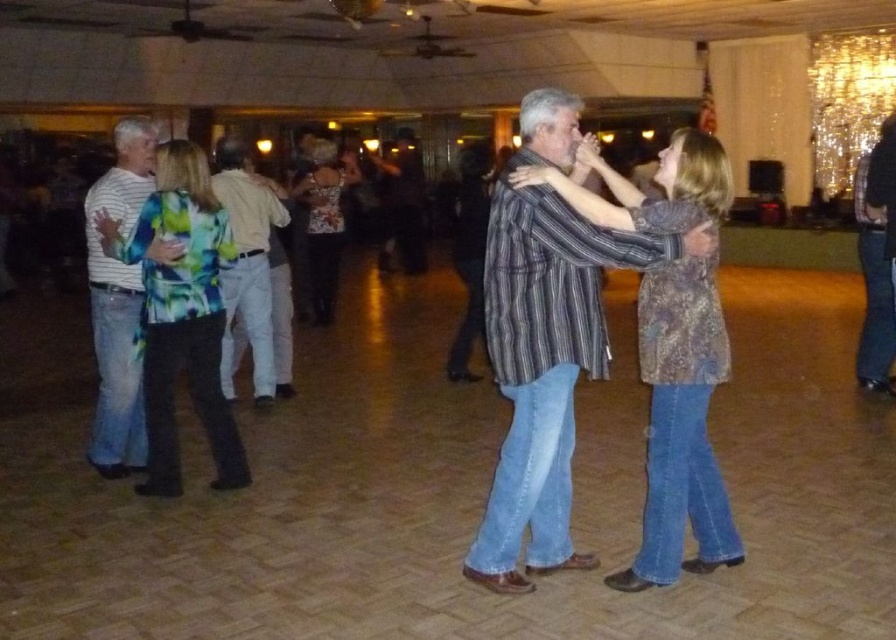
Is striped cotton shirt at left taller than light brown cotton shirt at center?

Correct, striped cotton shirt at left is much taller as light brown cotton shirt at center.

Is point (92, 278) less distant than point (270, 396)?

Yes, it is in front of point (270, 396).

Between point (126, 180) and point (237, 275), which one is positioned in front?

Point (126, 180)

Where is `striped cotton shirt at left`? striped cotton shirt at left is located at coordinates pos(118,305).

What do you see at coordinates (545, 340) in the screenshot? This screenshot has width=896, height=640. I see `striped cotton shirt at center` at bounding box center [545, 340].

Can you confirm if striped cotton shirt at center is bigger than dark brown leather jacket at center?

Actually, striped cotton shirt at center might be smaller than dark brown leather jacket at center.

In order to click on striped cotton shirt at center in this screenshot , I will do `click(545, 340)`.

I want to click on striped cotton shirt at center, so click(545, 340).

In the scene shown: Does printed silk blouse at center appear on the right side of dark brown leather jacket at center?

In fact, printed silk blouse at center is to the left of dark brown leather jacket at center.

Is printed silk blouse at center above dark brown leather jacket at center?

No, printed silk blouse at center is not above dark brown leather jacket at center.

This screenshot has height=640, width=896. What are the coordinates of `printed silk blouse at center` in the screenshot? It's located at (323, 221).